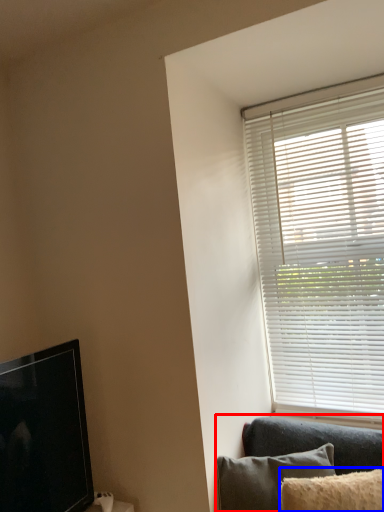
Question: Which object is further to the camera taking this photo, studio couch (highlighted by a red box) or pillow (highlighted by a blue box)?

Choices:
 (A) studio couch
 (B) pillow

Answer: (A)